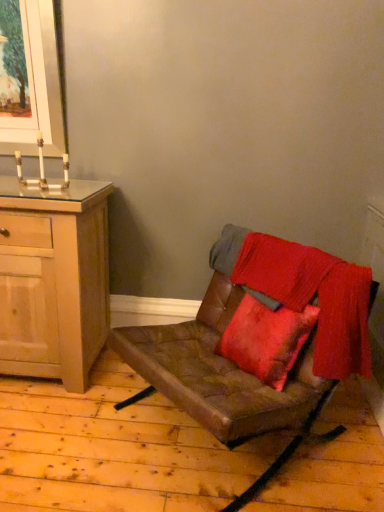
Image resolution: width=384 pixels, height=512 pixels. What do you see at coordinates (53, 280) in the screenshot? I see `light wood cabinet at left` at bounding box center [53, 280].

I want to click on light wood cabinet at left, so click(x=53, y=280).

Describe the element at coordinates (214, 364) in the screenshot. I see `brown leather chair at center` at that location.

You are a GUI agent. You are given a task and a screenshot of the screen. Output one action in this format:
    pyautogui.click(x=<x>, y=<y>)
    Task: Click on the brown leather chair at center
    
    Given the screenshot: What is the action you would take?
    pyautogui.click(x=214, y=364)

Where is `light wood cabinet at left`? light wood cabinet at left is located at coordinates (53, 280).

Would you say light wood cabinet at left is to the left or to the right of brown leather chair at center in the picture?

light wood cabinet at left is positioned on brown leather chair at center's left side.

Is light wood cabinet at left in front of or behind brown leather chair at center in the image?

In the image, light wood cabinet at left appears behind brown leather chair at center.

Considering the points (39, 251) and (141, 345), which point is in front, point (39, 251) or point (141, 345)?

The point (141, 345) is closer to the camera.

From the image's perspective, is light wood cabinet at left above brown leather chair at center?

Correct, light wood cabinet at left appears higher than brown leather chair at center in the image.

From a real-world perspective, is light wood cabinet at left physically below brown leather chair at center?

No.

Which of these two, light wood cabinet at left or brown leather chair at center, is wider?

brown leather chair at center.

Can you confirm if light wood cabinet at left is shorter than brown leather chair at center?

Incorrect, the height of light wood cabinet at left does not fall short of that of brown leather chair at center.

Can you confirm if light wood cabinet at left is bigger than brown leather chair at center?

No.

Which is correct: light wood cabinet at left is inside brown leather chair at center, or outside of it?

light wood cabinet at left is not inside brown leather chair at center, it's outside.

Is light wood cabinet at left far away from brown leather chair at center?

No, light wood cabinet at left is in close proximity to brown leather chair at center.

Looking at this image, is light wood cabinet at left oriented towards brown leather chair at center?

No, light wood cabinet at left is not oriented towards brown leather chair at center.

How different are the orientations of light wood cabinet at left and brown leather chair at center in degrees?

The facing directions of light wood cabinet at left and brown leather chair at center are 43.4 degrees apart.

How far apart are light wood cabinet at left and brown leather chair at center?

58.10 centimeters.

I want to click on cabinetry above the brown leather chair at center (from the image's perspective), so click(53, 280).

Considering the positions of objects brown leather chair at center and light wood cabinet at left in the image provided, who is more to the right, brown leather chair at center or light wood cabinet at left?

Positioned to the right is brown leather chair at center.

Who is more distant, brown leather chair at center or light wood cabinet at left?

Positioned behind is light wood cabinet at left.

Is point (363, 291) more distant than point (85, 219)?

No.

From the image's perspective, which object appears higher, brown leather chair at center or light wood cabinet at left?

light wood cabinet at left appears higher in the image.

From a real-world perspective, which is physically above, brown leather chair at center or light wood cabinet at left?

In real-world perspective, light wood cabinet at left is above.

Considering the relative sizes of brown leather chair at center and light wood cabinet at left in the image provided, is brown leather chair at center thinner than light wood cabinet at left?

No, brown leather chair at center is not thinner than light wood cabinet at left.

Between brown leather chair at center and light wood cabinet at left, which one has less height?

brown leather chair at center.

Can you confirm if brown leather chair at center is bigger than light wood cabinet at left?

Indeed, brown leather chair at center has a larger size compared to light wood cabinet at left.

Is brown leather chair at center positioned beyond the bounds of light wood cabinet at left?

Absolutely, brown leather chair at center is external to light wood cabinet at left.

Is there a large distance between brown leather chair at center and light wood cabinet at left?

No, brown leather chair at center is in close proximity to light wood cabinet at left.

Is brown leather chair at center facing away from light wood cabinet at left?

No, brown leather chair at center is not facing the opposite direction of light wood cabinet at left.

In the scene shown: Can you tell me how much brown leather chair at center and light wood cabinet at left differ in facing direction?

The angle between the facing direction of brown leather chair at center and the facing direction of light wood cabinet at left is 43.4 degrees.

The width and height of the screenshot is (384, 512). What are the coordinates of `cabinetry lying behind the brown leather chair at center` in the screenshot? It's located at (53, 280).

The image size is (384, 512). In order to click on cabinetry that is above the brown leather chair at center (from a real-world perspective) in this screenshot , I will do `click(53, 280)`.

Locate an element on the screen. chair in front of the light wood cabinet at left is located at coordinates (214, 364).